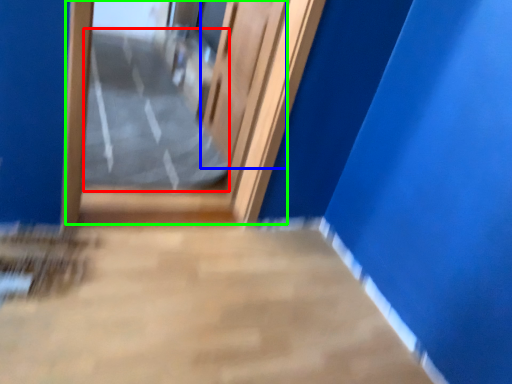
Question: Estimate the real-world distances between objects in this image. Which object is farther from path (highlighted by a red box), elevator door (highlighted by a blue box) or door (highlighted by a green box)?

Choices:
 (A) elevator door
 (B) door

Answer: (A)